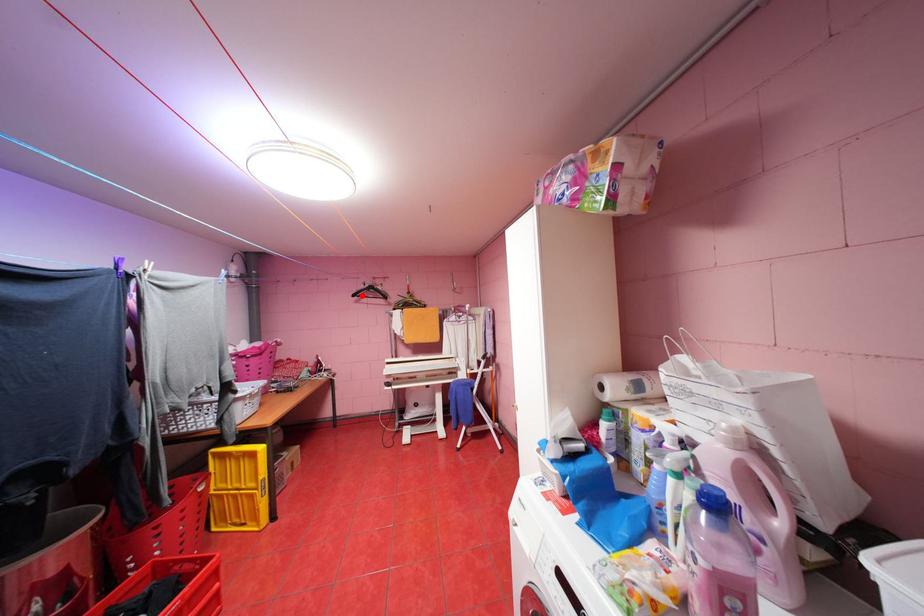
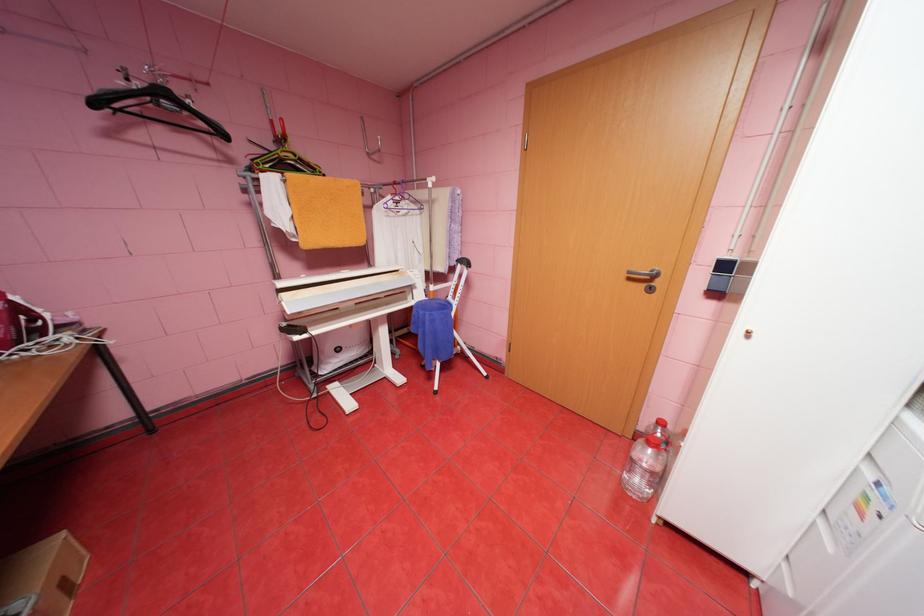
Question: I am providing you with two images of the same scene from different viewpoints. Given a red point in image1, look at the same physical point in image2. Is it:

Choices:
 (A) Closer to the viewpoint
 (B) Farther from the viewpoint

Answer: (B)